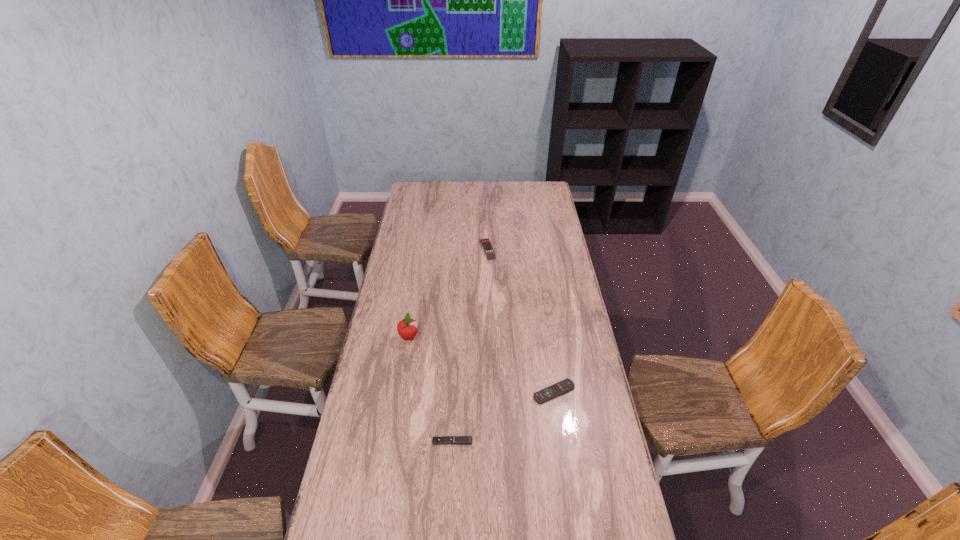
Find the location of a particular element. object that is the closest to the farthest remote control is located at coordinates (407, 328).

Locate which remote control ranks in proximity to the rightmost remote control. Please provide its 2D coordinates. Your answer should be formatted as a tuple, i.e. [(x, y)], where the tuple contains the x and y coordinates of a point satisfying the conditions above.

[(460, 440)]

Where is `the closest remote control relative to the leftmost object`? the closest remote control relative to the leftmost object is located at coordinates (460, 440).

Locate an element on the screen. This screenshot has height=540, width=960. free spot that satisfies the following two spatial constraints: 1. on the back side of the farthest object; 2. on the right side of the tallest object is located at coordinates (422, 249).

Locate an element on the screen. This screenshot has height=540, width=960. vacant space that satisfies the following two spatial constraints: 1. on the front side of the farthest object; 2. on the right side of the rightmost remote control is located at coordinates (491, 392).

Find the location of `free location that satisfies the following two spatial constraints: 1. on the front side of the third farthest object; 2. on the right side of the third nearest object`. free location that satisfies the following two spatial constraints: 1. on the front side of the third farthest object; 2. on the right side of the third nearest object is located at coordinates [x=399, y=392].